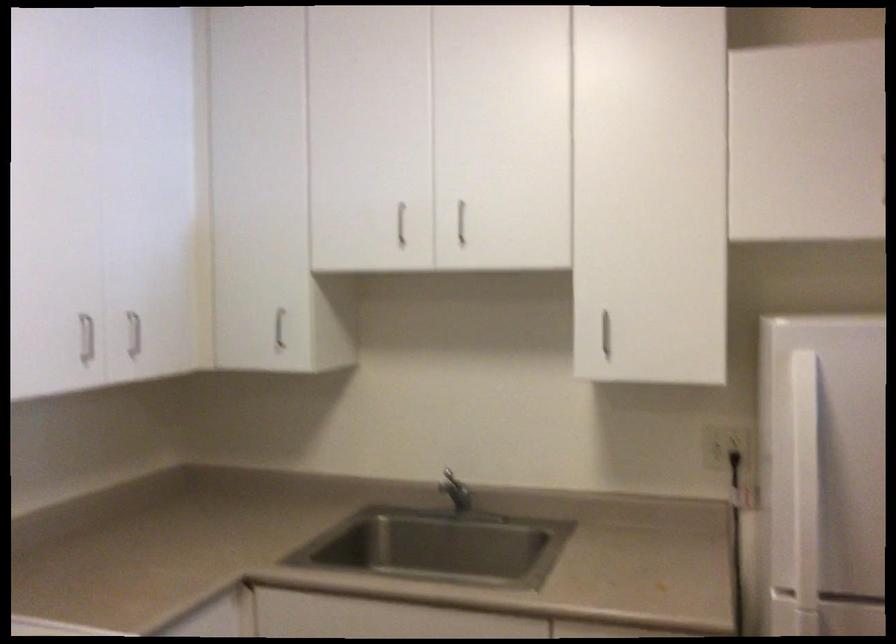
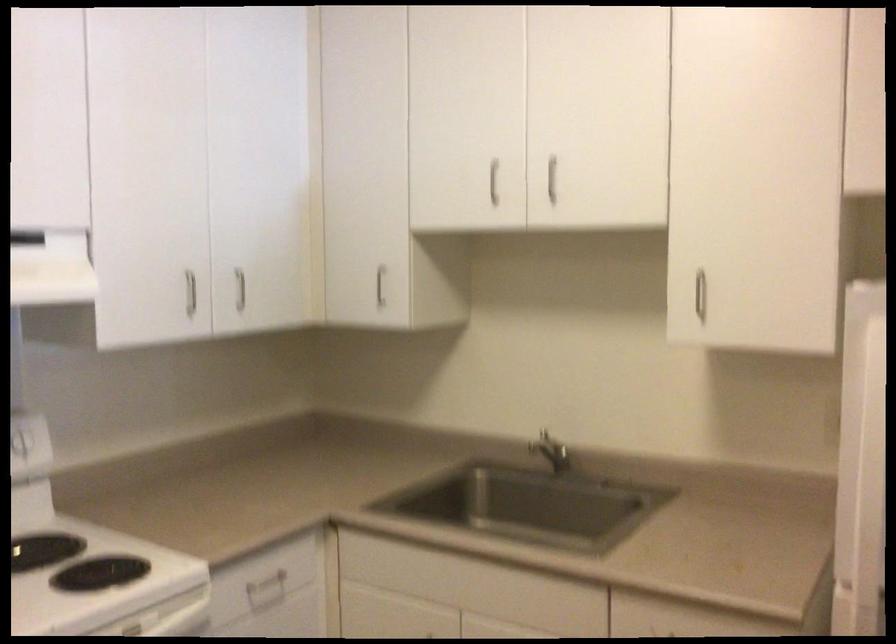
Question: Which direction would the cameraman need to move to produce the second image? Reply with the corresponding letter.

Choices:
 (A) Left
 (B) Right
 (C) Forward
 (D) Backward

Answer: (B)